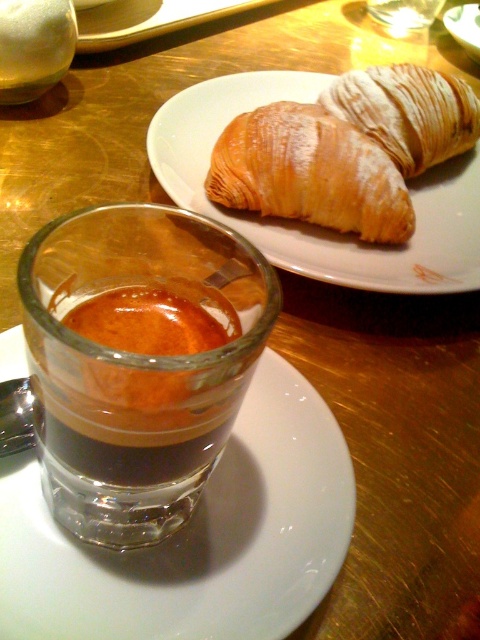
Is the position of transparent glass cup at center less distant than that of golden brown croissant at upper right?

Yes, it is.

What do you see at coordinates (196, 538) in the screenshot? I see `transparent glass cup at center` at bounding box center [196, 538].

Locate an element on the screen. This screenshot has width=480, height=640. transparent glass cup at center is located at coordinates (196, 538).

The width and height of the screenshot is (480, 640). Find the location of `transparent glass cup at center`. transparent glass cup at center is located at coordinates (196, 538).

Can you confirm if golden flaky croissant at upper center is positioned to the left of translucent glass cup at center?

In fact, golden flaky croissant at upper center is to the right of translucent glass cup at center.

Does golden flaky croissant at upper center have a larger size compared to translucent glass cup at center?

Correct, golden flaky croissant at upper center is larger in size than translucent glass cup at center.

You are a GUI agent. You are given a task and a screenshot of the screen. Output one action in this format:
    pyautogui.click(x=<x>, y=<y>)
    Task: Click on the golden flaky croissant at upper center
    
    Given the screenshot: What is the action you would take?
    pyautogui.click(x=310, y=172)

Is point (98, 509) behind point (365, 77)?

No, it is in front of (365, 77).

Describe the element at coordinates (135, 368) in the screenshot. The image size is (480, 640). I see `translucent glass espresso at center` at that location.

Locate an element on the screen. This screenshot has height=640, width=480. translucent glass espresso at center is located at coordinates click(135, 368).